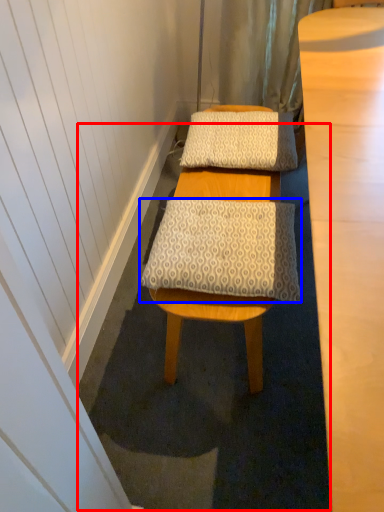
Question: Which object is closer to the camera taking this photo, bath mat (highlighted by a red box) or pillow (highlighted by a blue box)?

Choices:
 (A) bath mat
 (B) pillow

Answer: (B)